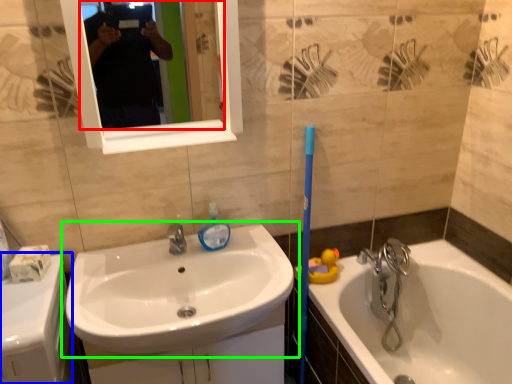
Question: Which object is positioned closest to mirror (highlighted by a red box)? Select from counter top (highlighted by a blue box) and sink (highlighted by a green box).

Choices:
 (A) counter top
 (B) sink

Answer: (B)